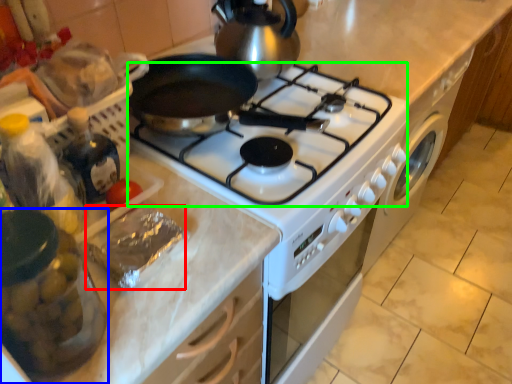
Question: Considering the real-world distances, which object is farthest from food (highlighted by a red box)? kitchen appliance (highlighted by a blue box) or gas stove (highlighted by a green box)?

Choices:
 (A) kitchen appliance
 (B) gas stove

Answer: (B)